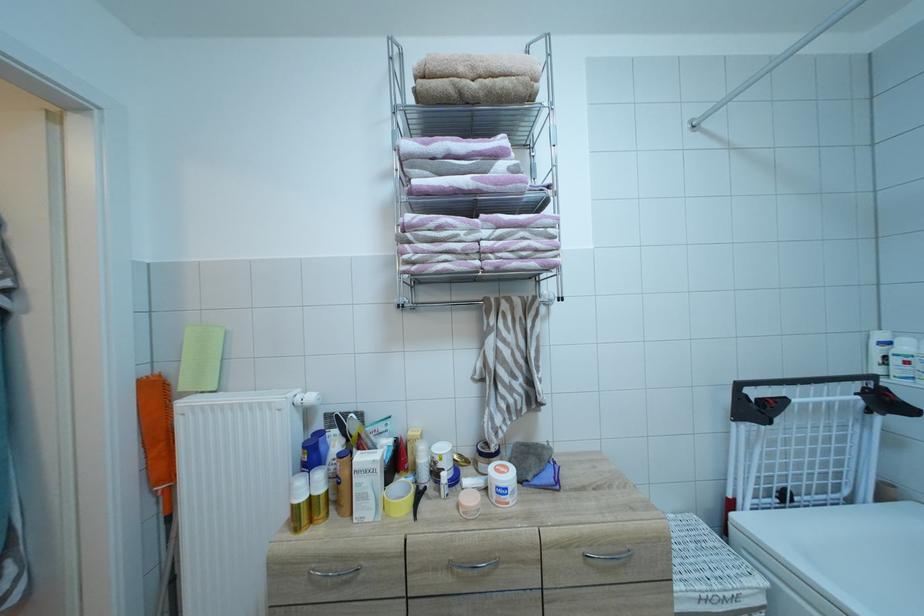
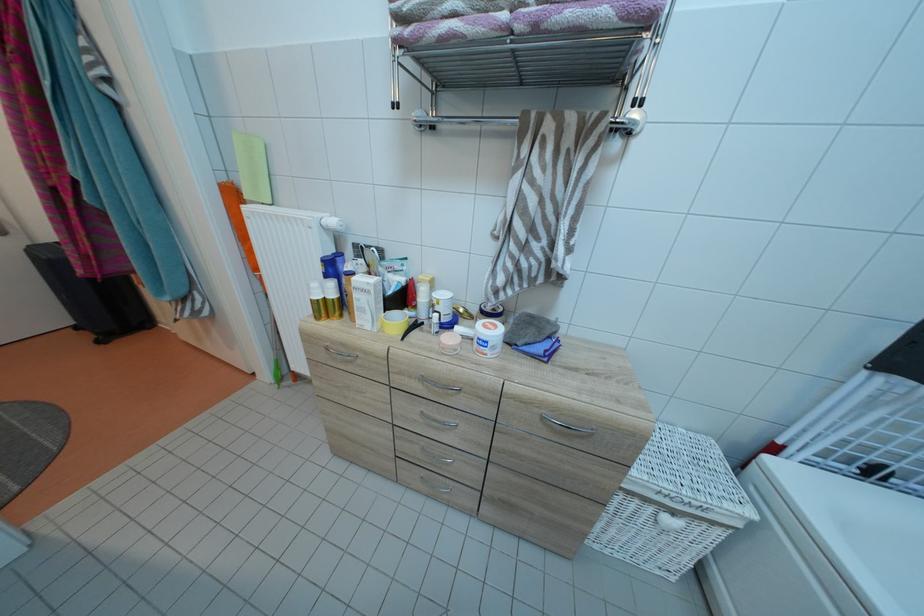
Find the pixel in the second image that matches point (464, 519) in the first image.

(444, 352)